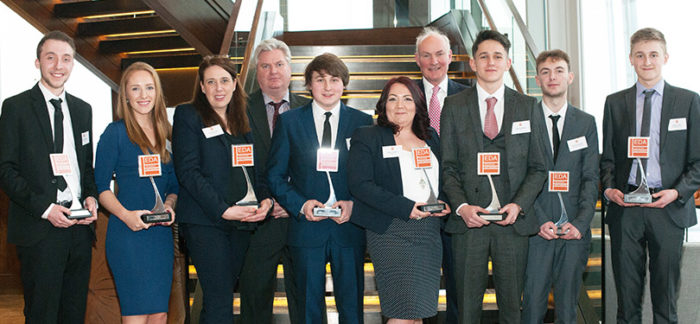
In order to click on stairs in this screenshot , I will do `click(365, 71)`, `click(143, 35)`.